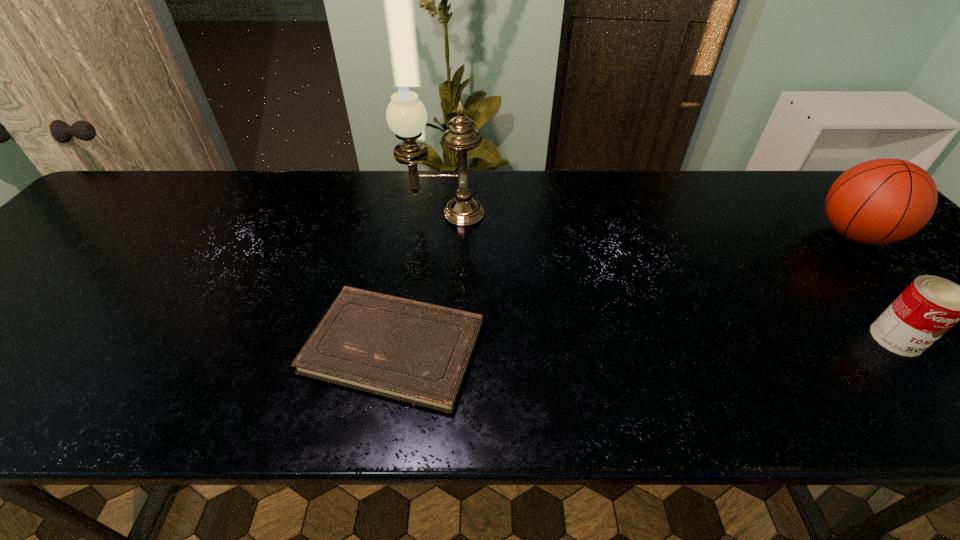
What are the coordinates of `object present at the near edge` in the screenshot? It's located at (416, 352).

Locate an element on the screen. This screenshot has height=540, width=960. object at the right edge is located at coordinates [x=880, y=201].

At what (x,y) coordinates should I click in order to perform the action: click on object at the far right corner. Please return your answer as a coordinate pair (x, y). Looking at the image, I should click on (880, 201).

What are the coordinates of `vacant space at the far edge` in the screenshot? It's located at (341, 208).

The image size is (960, 540). I want to click on vacant space at the near edge of the desktop, so click(x=754, y=383).

Where is `free space at the far left corner`? This screenshot has width=960, height=540. free space at the far left corner is located at coordinates (153, 208).

This screenshot has height=540, width=960. In the image, there is a desktop. In order to click on free space at the far right corner in this screenshot , I will do [817, 188].

The image size is (960, 540). What are the coordinates of `vacant space in between the tallest object and the paperback book` in the screenshot? It's located at (419, 281).

Where is `vacant area that lies between the second tallest object and the paperback book`? The width and height of the screenshot is (960, 540). vacant area that lies between the second tallest object and the paperback book is located at coordinates (624, 291).

This screenshot has width=960, height=540. In order to click on vacant area between the oil lamp and the third tallest object in this screenshot , I will do pyautogui.click(x=669, y=276).